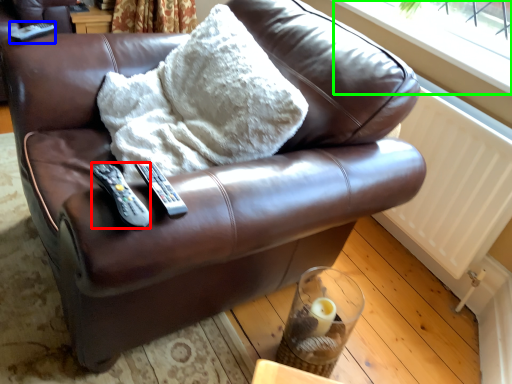
Question: Which object is positioned farthest from remote (highlighted by a red box)? Select from remote (highlighted by a blue box) and window frame (highlighted by a green box).

Choices:
 (A) remote
 (B) window frame

Answer: (B)